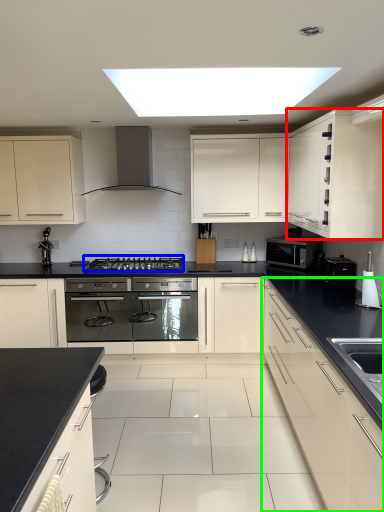
Question: Which object is the closest to the cabinetry (highlighted by a red box)? Choose among these: gas stove (highlighted by a blue box) or cabinetry (highlighted by a green box).

Choices:
 (A) gas stove
 (B) cabinetry

Answer: (B)